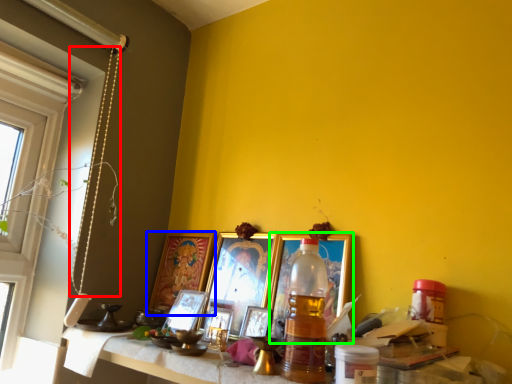
Question: Considering the real-world distances, which object is closest to string (highlighted by a red box)? picture frame (highlighted by a blue box) or picture frame (highlighted by a green box).

Choices:
 (A) picture frame
 (B) picture frame

Answer: (A)